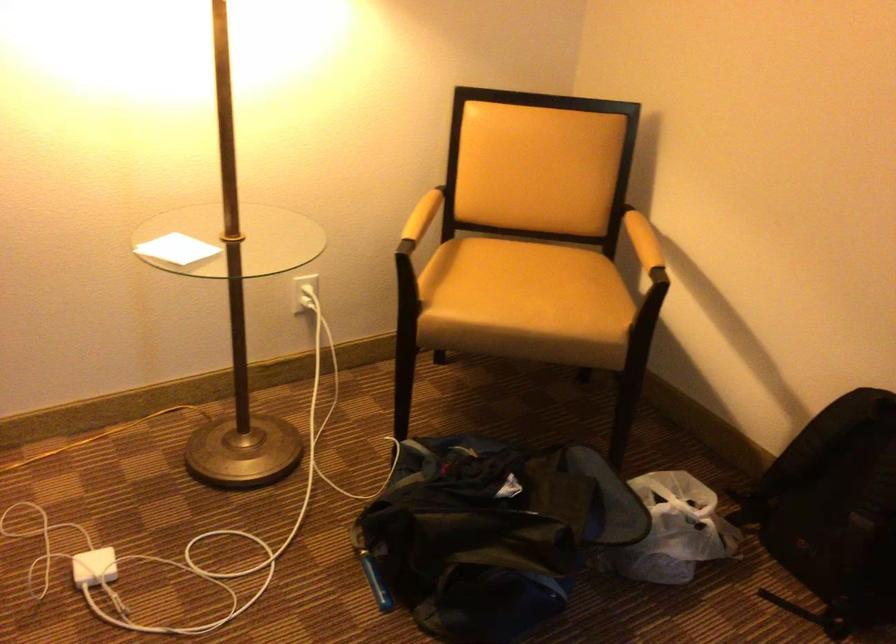
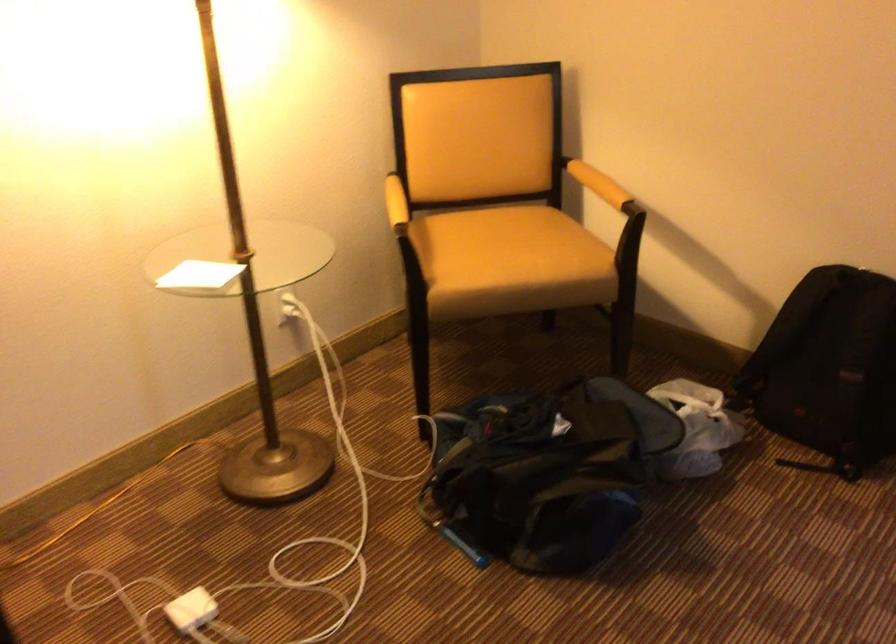
Where in the second image is the point corresponding to [176,249] from the first image?

(199, 275)